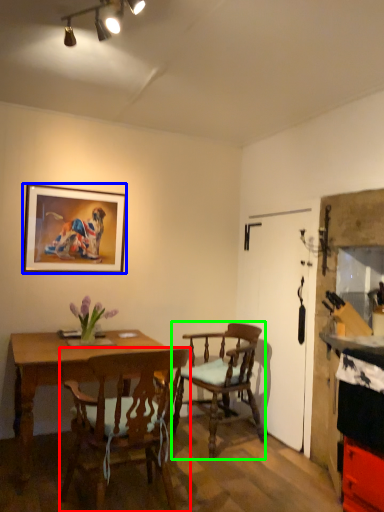
Question: Which object is the farthest from chair (highlighted by a red box)? Choose among these: picture frame (highlighted by a blue box) or chair (highlighted by a green box).

Choices:
 (A) picture frame
 (B) chair

Answer: (A)